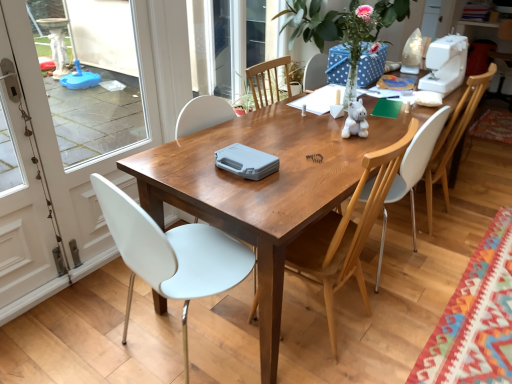
Identify the location of vacant space behind multicolored woven mat at lower right. This screenshot has width=512, height=384. (464, 214).